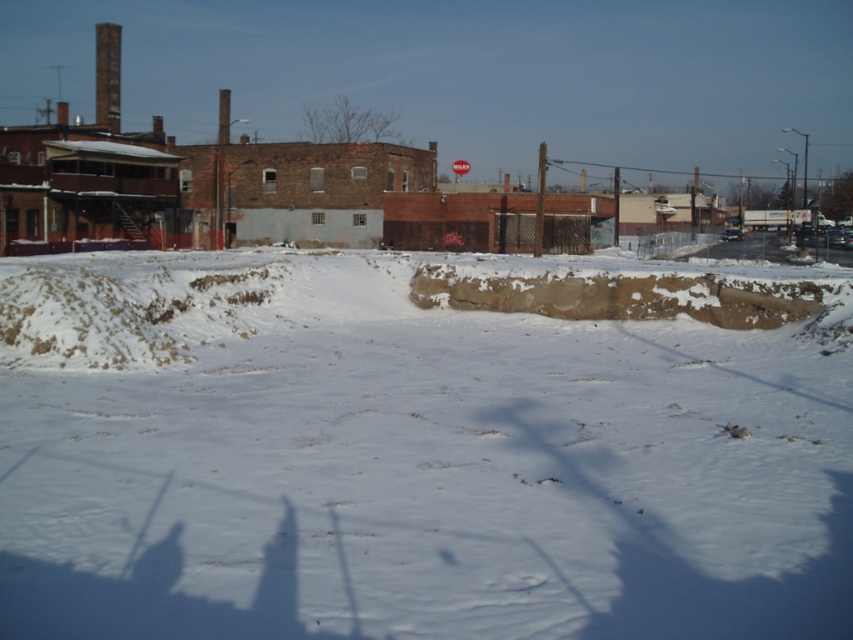
Is white powdery snow at center smaller than red plastic sign at upper center?

Yes.

Who is positioned more to the right, white powdery snow at center or red plastic sign at upper center?

red plastic sign at upper center is more to the right.

At what (x,y) coordinates should I click in order to perform the action: click on white powdery snow at center. Please return your answer as a coordinate pair (x, y). The width and height of the screenshot is (853, 640). Looking at the image, I should click on pos(404,460).

Describe the element at coordinates (624, 294) in the screenshot. I see `brown dirt mound at center` at that location.

Who is positioned more to the left, brown dirt mound at center or red plastic sign at upper center?

brown dirt mound at center is more to the left.

The height and width of the screenshot is (640, 853). What do you see at coordinates (624, 294) in the screenshot?
I see `brown dirt mound at center` at bounding box center [624, 294].

The width and height of the screenshot is (853, 640). I want to click on brown dirt mound at center, so click(624, 294).

Which is behind, point (418, 429) or point (595, 280)?

The point (595, 280) is more distant.

Which is in front, point (321, 465) or point (471, 269)?

Point (321, 465) is more forward.

Locate an element on the screen. The image size is (853, 640). white powdery snow at center is located at coordinates (404, 460).